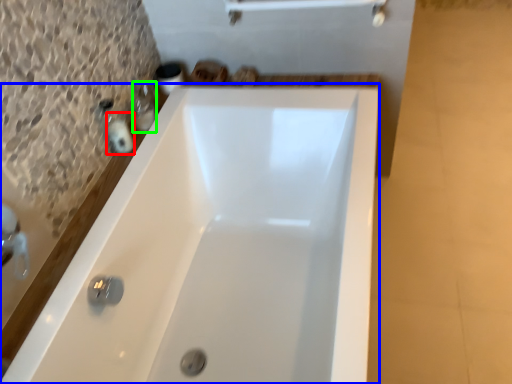
Question: Based on their relative distances, which object is nearer to toiletry (highlighted by a red box)? Choose from bathtub (highlighted by a blue box) and toiletry (highlighted by a green box).

Choices:
 (A) bathtub
 (B) toiletry

Answer: (B)